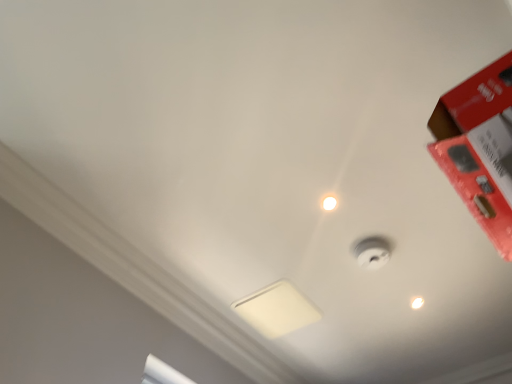
Measure the distance between point (415, 307) and camera.

Point (415, 307) is 2.02 meters away from camera.

Image resolution: width=512 pixels, height=384 pixels. What do you see at coordinates (417, 303) in the screenshot? I see `white glossy light bulb at upper center` at bounding box center [417, 303].

The width and height of the screenshot is (512, 384). I want to click on white matte lamp at center, so click(x=277, y=310).

Locate an element on the screen. This screenshot has width=512, height=384. white glossy light bulb at upper center is located at coordinates (417, 303).

Consider the image. Can you confirm if white matte lamp at center is positioned to the left of red matte box at upper right?

Indeed, white matte lamp at center is positioned on the left side of red matte box at upper right.

How many degrees apart are the facing directions of white matte lamp at center and red matte box at upper right?

The angular difference between white matte lamp at center and red matte box at upper right is 92.9 degrees.

Is white matte lamp at center turned away from red matte box at upper right?

white matte lamp at center does not have its back to red matte box at upper right.

From a real-world perspective, who is located higher, white matte lamp at center or red matte box at upper right?

white matte lamp at center is physically above.

Which object is wider, white glossy light bulb at upper center or white matte lamp at center?

white matte lamp at center.

From the image's perspective, which is below, white glossy light bulb at upper center or white matte lamp at center?

From the image's view, white matte lamp at center is below.

Considering the relative sizes of white glossy light bulb at upper center and white matte lamp at center in the image provided, is white glossy light bulb at upper center smaller than white matte lamp at center?

Yes.

Which is correct: red matte box at upper right is inside white glossy light bulb at upper center, or outside of it?

The correct answer is: outside.

Is red matte box at upper right closer to the viewer compared to white glossy light bulb at upper center?

Yes, it is in front of white glossy light bulb at upper center.

Between red matte box at upper right and white glossy light bulb at upper center, which one has less height?

Standing shorter between the two is white glossy light bulb at upper center.

Looking at their sizes, would you say red matte box at upper right is wider or thinner than white glossy light bulb at upper center?

Clearly, red matte box at upper right has more width compared to white glossy light bulb at upper center.

Measure the distance between white matte lamp at center and white glossy light bulb at upper center.

They are 63.38 centimeters apart.

Is white matte lamp at center with white glossy light bulb at upper center?

No, white matte lamp at center is not making contact with white glossy light bulb at upper center.

Between white matte lamp at center and white glossy light bulb at upper center, which one has smaller size?

Smaller between the two is white glossy light bulb at upper center.

Is white matte lamp at center facing away from white glossy light bulb at upper center?

No, white matte lamp at center is not facing away from white glossy light bulb at upper center.

Considering the sizes of objects red matte box at upper right and white glossy droplight at upper center in the image provided, who is bigger, red matte box at upper right or white glossy droplight at upper center?

red matte box at upper right is bigger.

Identify the location of box in front of the white glossy droplight at upper center. (x=479, y=148).

From a real-world perspective, is white glossy droplight at upper center on red matte box at upper right?

Yes.

Considering the relative positions of white glossy droplight at upper center and red matte box at upper right in the image provided, is white glossy droplight at upper center to the left of red matte box at upper right from the viewer's perspective?

Yes.

Image resolution: width=512 pixels, height=384 pixels. What are the coordinates of `droplight to the left of red matte box at upper right` in the screenshot? It's located at (329, 202).

Is white glossy droplight at upper center with red matte box at upper right?

white glossy droplight at upper center is not next to red matte box at upper right, and they're not touching.

Is point (413, 300) farther from camera compared to point (333, 195)?

Yes.

Does white glossy light bulb at upper center have a greater width compared to white glossy droplight at upper center?

No, white glossy light bulb at upper center is not wider than white glossy droplight at upper center.

Is white glossy light bulb at upper center positioned beyond the bounds of white glossy droplight at upper center?

Indeed, white glossy light bulb at upper center is completely outside white glossy droplight at upper center.

Which of these two, white glossy light bulb at upper center or white glossy droplight at upper center, is smaller?

Smaller between the two is white glossy light bulb at upper center.

Image resolution: width=512 pixels, height=384 pixels. I want to click on lamp above the red matte box at upper right (from a real-world perspective), so click(x=277, y=310).

Where is `light bulb below the white matte lamp at center (from a real-world perspective)`? Image resolution: width=512 pixels, height=384 pixels. light bulb below the white matte lamp at center (from a real-world perspective) is located at coordinates (417, 303).

From the image, which object appears to be farther from white glossy droplight at upper center, white matte lamp at center or red matte box at upper right?

red matte box at upper right is positioned further to the anchor white glossy droplight at upper center.

Considering their positions, is white matte lamp at center positioned closer to white glossy light bulb at upper center than white glossy droplight at upper center?

Among the two, white matte lamp at center is located nearer to white glossy light bulb at upper center.

From the image, which object appears to be nearer to red matte box at upper right, white glossy light bulb at upper center or white glossy droplight at upper center?

Among the two, white glossy droplight at upper center is located nearer to red matte box at upper right.

Which object lies further to the anchor point white glossy droplight at upper center, white glossy light bulb at upper center or white matte lamp at center?

white glossy light bulb at upper center lies further to white glossy droplight at upper center than the other object.

When comparing their distances from white matte lamp at center, does white glossy light bulb at upper center or white glossy droplight at upper center seem closer?

Based on the image, white glossy light bulb at upper center appears to be nearer to white matte lamp at center.

Estimate the real-world distances between objects in this image. Which object is further from white glossy droplight at upper center, white matte lamp at center or white glossy light bulb at upper center?

Based on the image, white glossy light bulb at upper center appears to be further to white glossy droplight at upper center.

Which object lies further to the anchor point red matte box at upper right, white glossy droplight at upper center or white matte lamp at center?

white matte lamp at center lies further to red matte box at upper right than the other object.

In the scene shown: Estimate the real-world distances between objects in this image. Which object is closer to red matte box at upper right, white matte lamp at center or white glossy light bulb at upper center?

white matte lamp at center is positioned closer to the anchor red matte box at upper right.

What are the coordinates of `droplight between red matte box at upper right and white matte lamp at center from front to back` in the screenshot? It's located at (329, 202).

Find the location of a particular element. lamp between red matte box at upper right and white glossy light bulb at upper center from front to back is located at coordinates (277, 310).

At what (x,y) coordinates should I click in order to perform the action: click on droplight between red matte box at upper right and white glossy light bulb at upper center along the z-axis. Please return your answer as a coordinate pair (x, y). The width and height of the screenshot is (512, 384). Looking at the image, I should click on (329, 202).

This screenshot has width=512, height=384. Identify the location of droplight situated between white matte lamp at center and white glossy light bulb at upper center from left to right. (329, 202).